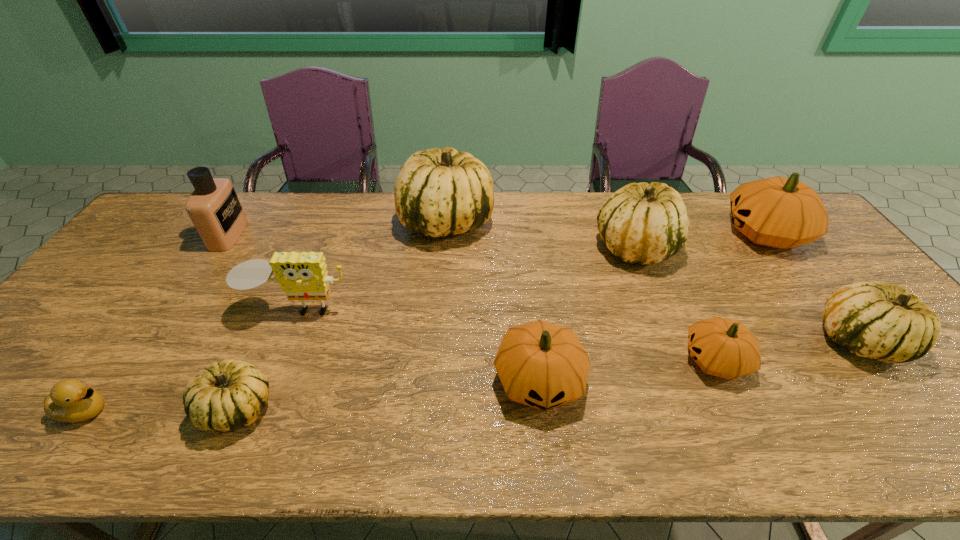
The height and width of the screenshot is (540, 960). I want to click on free space located 0.060m on the side of the leftmost orange gourd with the carved face, so click(547, 450).

Where is `vacant space located 0.310m on the left of the rightmost white gourd`? Image resolution: width=960 pixels, height=540 pixels. vacant space located 0.310m on the left of the rightmost white gourd is located at coordinates (693, 340).

In order to click on vacant space situated 0.070m on the side of the second orange gourd from right to left with the carved face in this screenshot , I will do `click(653, 360)`.

The height and width of the screenshot is (540, 960). I want to click on free point located on the side of the second orange gourd from right to left with the carved face, so click(636, 360).

At what (x,y) coordinates should I click in order to perform the action: click on blank space located on the side of the second orange gourd from right to left with the carved face. Please return your answer as a coordinate pair (x, y). The height and width of the screenshot is (540, 960). Looking at the image, I should click on (520, 360).

Find the location of a particular element. The width and height of the screenshot is (960, 540). free space located 0.050m on the left of the leftmost white gourd is located at coordinates (179, 408).

At what (x,y) coordinates should I click in order to perform the action: click on vacant area located 0.140m on the face of the duckling. Please return your answer as a coordinate pair (x, y). The image size is (960, 540). Looking at the image, I should click on (175, 411).

The height and width of the screenshot is (540, 960). In order to click on perfume at the far edge in this screenshot , I will do `click(214, 208)`.

Where is `duckling that is at the near edge`? The image size is (960, 540). duckling that is at the near edge is located at coordinates 71,401.

Identify the location of object present at the left edge. The height and width of the screenshot is (540, 960). (71, 401).